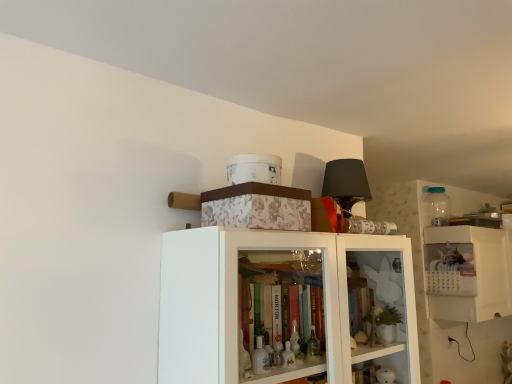
Question: From the image's perspective, would you say transparent plastic bottle at upper right is positioned over white plastic calendar at upper right?

Choices:
 (A) yes
 (B) no

Answer: (A)

Question: Does transparent plastic bottle at upper right appear on the left side of white plastic calendar at upper right?

Choices:
 (A) no
 (B) yes

Answer: (B)

Question: Is white plastic calendar at upper right at the back of transparent plastic bottle at upper right?

Choices:
 (A) no
 (B) yes

Answer: (A)

Question: Is transparent plastic bottle at upper right not near white plastic calendar at upper right?

Choices:
 (A) no
 (B) yes

Answer: (A)

Question: Can you confirm if transparent plastic bottle at upper right is shorter than white plastic calendar at upper right?

Choices:
 (A) yes
 (B) no

Answer: (A)

Question: Is transparent plastic bottle at upper right smaller than white plastic calendar at upper right?

Choices:
 (A) no
 (B) yes

Answer: (B)

Question: Considering the relative positions of transparent plastic bottle at upper right and white floral-patterned box at upper center in the image provided, is transparent plastic bottle at upper right to the left of white floral-patterned box at upper center from the viewer's perspective?

Choices:
 (A) no
 (B) yes

Answer: (A)

Question: Is transparent plastic bottle at upper right further to the viewer compared to white floral-patterned box at upper center?

Choices:
 (A) yes
 (B) no

Answer: (A)

Question: Is transparent plastic bottle at upper right thinner than white floral-patterned box at upper center?

Choices:
 (A) yes
 (B) no

Answer: (A)

Question: From a real-world perspective, is transparent plastic bottle at upper right on top of white floral-patterned box at upper center?

Choices:
 (A) yes
 (B) no

Answer: (A)

Question: Is transparent plastic bottle at upper right positioned far away from white floral-patterned box at upper center?

Choices:
 (A) yes
 (B) no

Answer: (A)

Question: Is transparent plastic bottle at upper right looking in the opposite direction of white floral-patterned box at upper center?

Choices:
 (A) no
 (B) yes

Answer: (A)

Question: Is white plastic calendar at upper right next to white floral-patterned box at upper center and touching it?

Choices:
 (A) no
 (B) yes

Answer: (A)